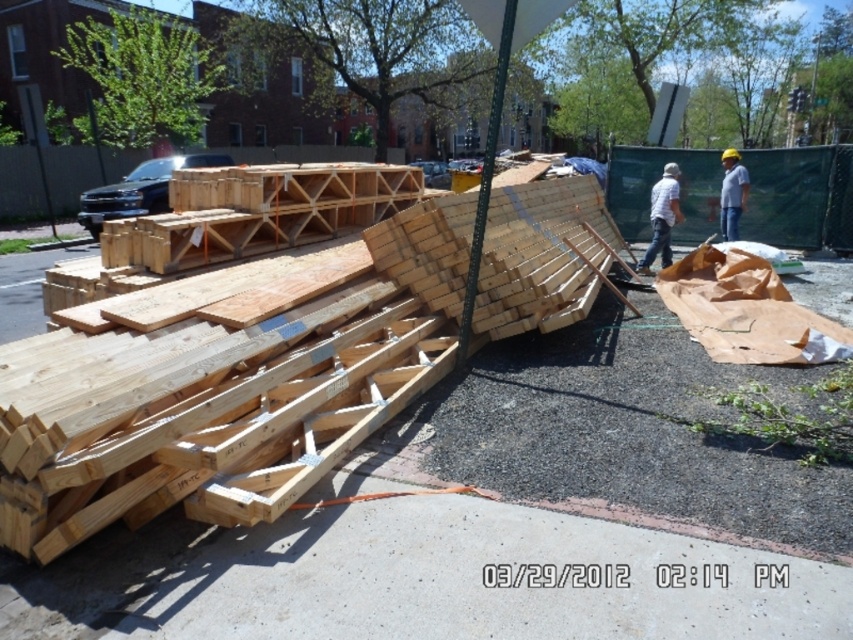
You are a construction worker trying to determine which object to move first. Which is smaller between the natural wood boards at center and the natural wood at center?

The natural wood boards at center is smaller than natural wood at center.

You are standing at the edge of the construction site and notice the natural wood at center and the white matte shirt at center. Which object is nearer to you?

The natural wood at center is closer to the viewer than the white matte shirt at center.